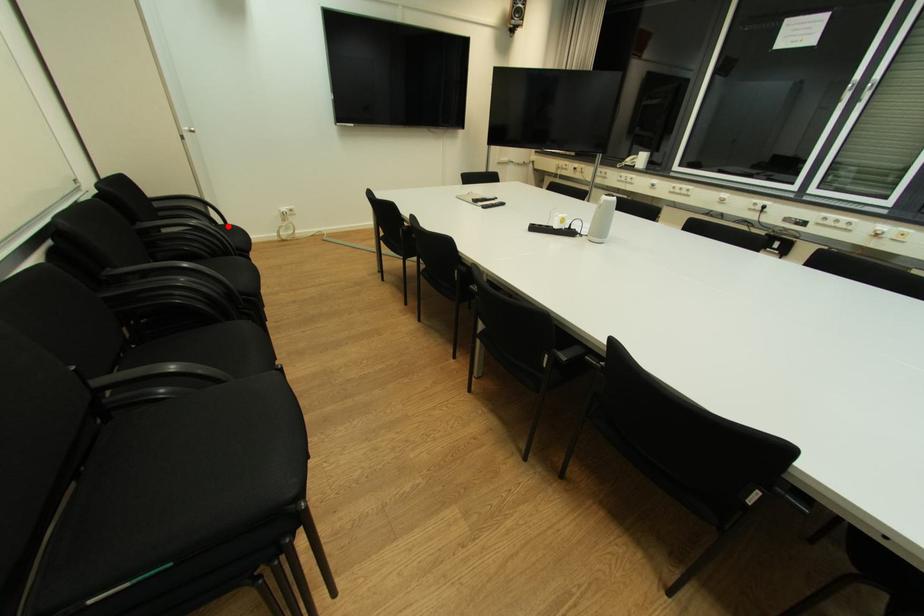
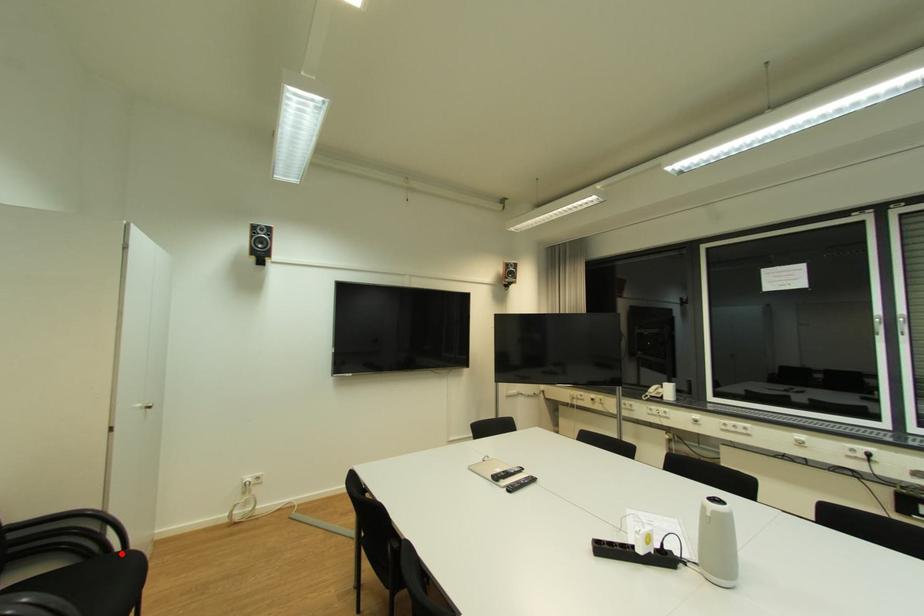
Looking at this image, I am providing you with two images of the same scene from different viewpoints. A red point is marked on the first image and another point is marked on the second image. Is the red point in image1 aligned with the point shown in image2?

Yes